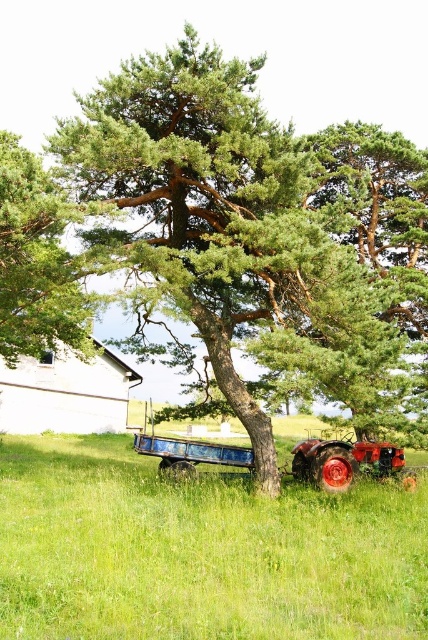
Does green grassy field at lower center have a lesser width compared to shiny red tractor at center?

No.

Who is shorter, green grassy field at lower center or shiny red tractor at center?

Standing shorter between the two is shiny red tractor at center.

At what (x,y) coordinates should I click in order to perform the action: click on green grassy field at lower center. Please return your answer as a coordinate pair (x, y). Looking at the image, I should click on (199, 552).

Is green leafy tree at center below shiny red tractor at center?

Actually, green leafy tree at center is above shiny red tractor at center.

You are a GUI agent. You are given a task and a screenshot of the screen. Output one action in this format:
    pyautogui.click(x=<x>, y=<y>)
    Task: Click on the green leafy tree at center
    
    Given the screenshot: What is the action you would take?
    pyautogui.click(x=249, y=237)

Which of these two, green needle-like leaves at upper center or shiny red tractor at center, stands shorter?

shiny red tractor at center

Can you confirm if green needle-like leaves at upper center is positioned below shiny red tractor at center?

No.

Which is in front, point (0, 328) or point (374, 445)?

Positioned in front is point (374, 445).

At what (x,y) coordinates should I click in order to perform the action: click on green needle-like leaves at upper center. Please return your answer as a coordinate pair (x, y). Looking at the image, I should click on (38, 260).